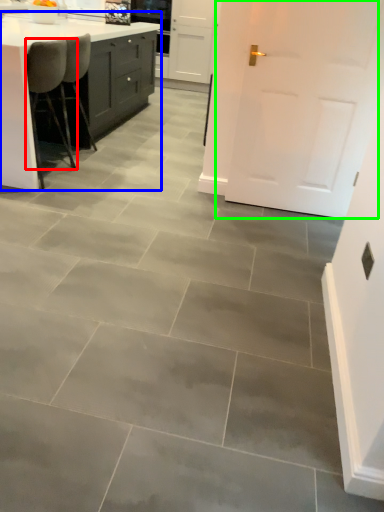
Question: Based on their relative distances, which object is farther from chair (highlighted by a red box)? Choose from countertop (highlighted by a blue box) and door (highlighted by a green box).

Choices:
 (A) countertop
 (B) door

Answer: (B)